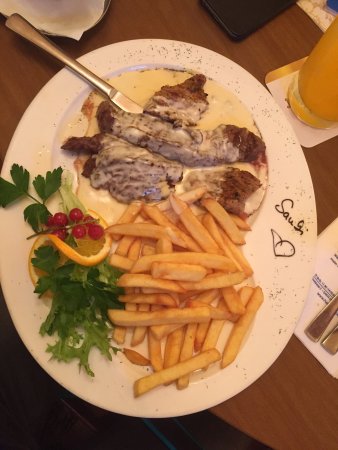
The height and width of the screenshot is (450, 338). I want to click on wood table, so click(290, 418).